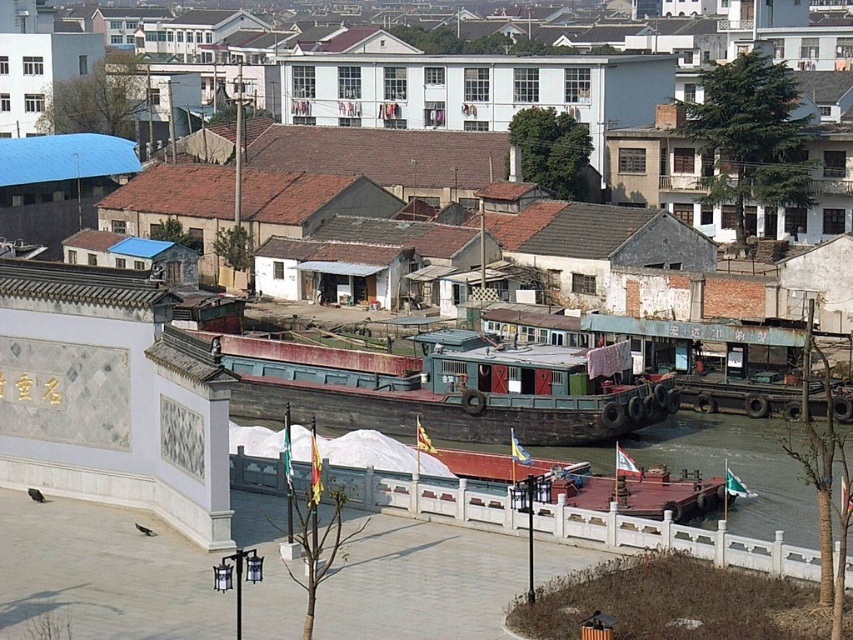
Question: Is the position of rusty wooden barge at center less distant than that of smooth brown water at lower right?

Choices:
 (A) yes
 (B) no

Answer: (B)

Question: Which point is closer to the camera?

Choices:
 (A) smooth brown water at lower right
 (B) rusty wooden barge at center

Answer: (A)

Question: Does rusty wooden barge at center appear on the right side of smooth brown water at lower right?

Choices:
 (A) no
 (B) yes

Answer: (A)

Question: Does rusty wooden barge at center appear under smooth brown water at lower right?

Choices:
 (A) yes
 (B) no

Answer: (B)

Question: Which object is farther from the camera taking this photo?

Choices:
 (A) smooth brown water at lower right
 (B) rusty wooden barge at center

Answer: (B)